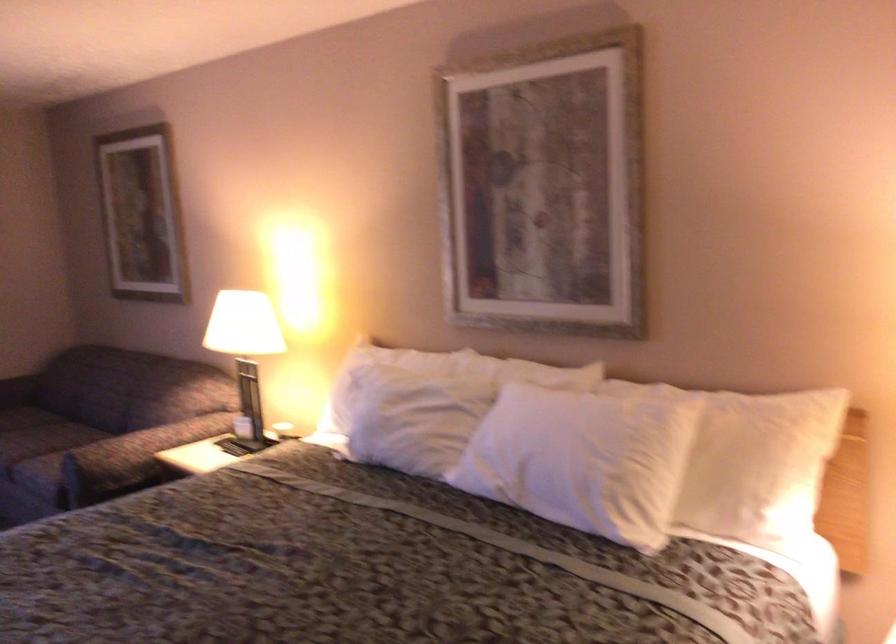
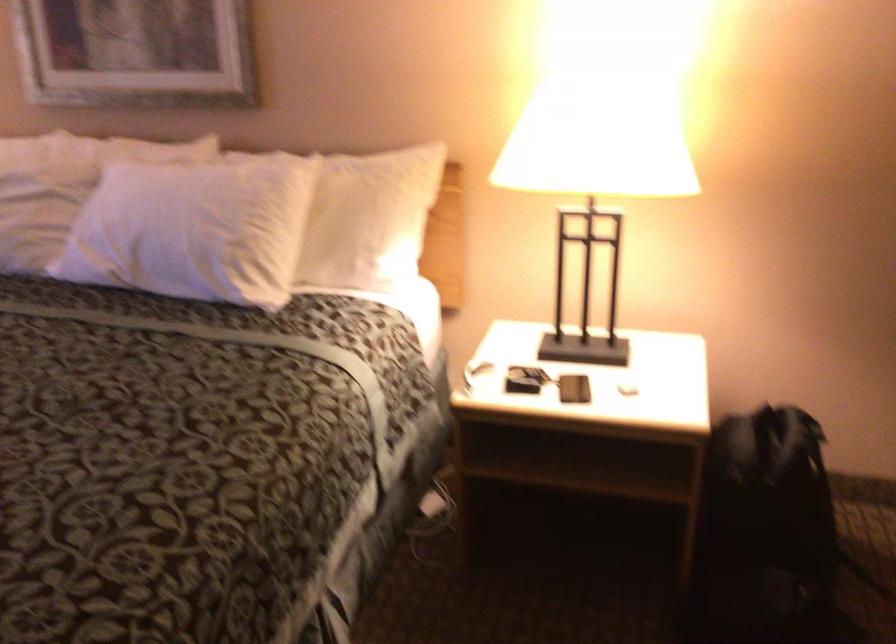
Question: In a continuous first-person perspective shot, in which direction is the camera moving?

Choices:
 (A) Left
 (B) Right
 (C) Forward
 (D) Backward

Answer: (B)